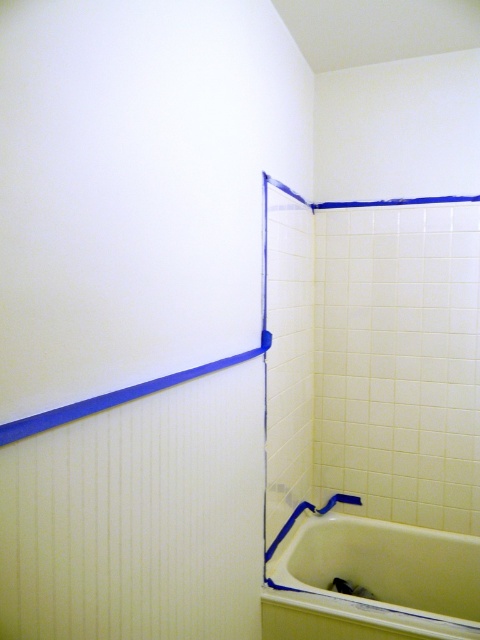
You are a painter standing at the center of the bathroom. You need to paint the walls but must avoid the white glossy bathtub at lower right. What is the minimum distance you should keep from the bathtub to ensure you don not accidentally paint it?

The white glossy bathtub at lower right is located at point (372,582). To avoid painting it, the painter should maintain a distance of at least 0.2 meters from the bathtub.

You are a painter working on the bathroom walls. You need to ensure that the blue tape at upper center is placed above the white glossy bathtub at lower right. Based on their heights, will the tape be above the bathtub?

The white glossy bathtub at lower right has a greater height compared to blue tape at upper center. Therefore, the blue tape at upper center will not be placed above the bathtub since the bathtub is taller.

Based on the photo, you are standing in the bathroom shown in the image. There is a point marked at coordinates (372, 582). What object is located at that point?

The point at coordinates (372, 582) marks the white glossy bathtub at lower right.